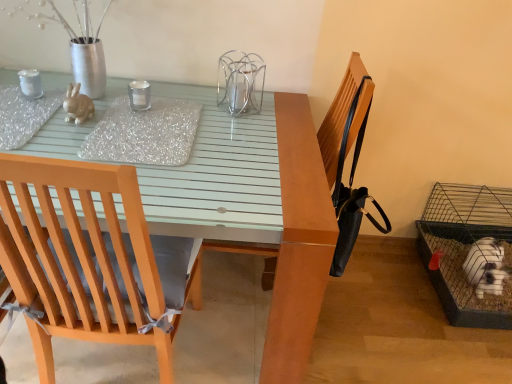
Question: Is matte ceramic rabbit at upper left facing towards black leather chair at upper right?

Choices:
 (A) no
 (B) yes

Answer: (A)

Question: Is matte ceramic rabbit at upper left further to camera compared to black leather chair at upper right?

Choices:
 (A) no
 (B) yes

Answer: (B)

Question: Does matte ceramic rabbit at upper left appear on the right side of black leather chair at upper right?

Choices:
 (A) no
 (B) yes

Answer: (A)

Question: From a real-world perspective, does matte ceramic rabbit at upper left stand above black leather chair at upper right?

Choices:
 (A) no
 (B) yes

Answer: (B)

Question: Can you confirm if matte ceramic rabbit at upper left is bigger than black leather chair at upper right?

Choices:
 (A) yes
 (B) no

Answer: (B)

Question: Considering the positions of wire mesh cage at lower right, the first bird cage from the right, and wooden chair at left in the image, is wire mesh cage at lower right, the first bird cage from the right, taller or shorter than wooden chair at left?

Choices:
 (A) tall
 (B) short

Answer: (B)

Question: Based on their sizes in the image, would you say wire mesh cage at lower right, marked as the 2th bird cage in a front-to-back arrangement, is bigger or smaller than wooden chair at left?

Choices:
 (A) big
 (B) small

Answer: (B)

Question: Considering the positions of wire mesh cage at lower right, which is the second bird cage in top-to-bottom order, and wooden chair at left in the image, is wire mesh cage at lower right, which is the second bird cage in top-to-bottom order, wider or thinner than wooden chair at left?

Choices:
 (A) wide
 (B) thin

Answer: (A)

Question: Considering their positions, is wire mesh cage at lower right, acting as the 2th bird cage starting from the left, located in front of or behind wooden chair at left?

Choices:
 (A) front
 (B) behind

Answer: (B)

Question: Considering their positions, is clear glass candle at center located in front of or behind wire mesh cage at lower right, acting as the 2th bird cage starting from the left?

Choices:
 (A) front
 (B) behind

Answer: (A)

Question: In the image, is clear glass candle at center on the left side or the right side of wire mesh cage at lower right, acting as the 2th bird cage starting from the left?

Choices:
 (A) left
 (B) right

Answer: (A)

Question: Is clear glass candle at center inside the boundaries of wire mesh cage at lower right, positioned as the 1th bird cage in bottom-to-top order, or outside?

Choices:
 (A) outside
 (B) inside

Answer: (A)

Question: Considering the positions of clear glass candle at center and wire mesh cage at lower right, acting as the 2th bird cage starting from the left, in the image, is clear glass candle at center wider or thinner than wire mesh cage at lower right, acting as the 2th bird cage starting from the left,?

Choices:
 (A) thin
 (B) wide

Answer: (A)

Question: Is clear glass candle at center taller or shorter than black leather chair at upper right?

Choices:
 (A) short
 (B) tall

Answer: (A)

Question: From a real-world perspective, is clear glass candle at center above or below black leather chair at upper right?

Choices:
 (A) below
 (B) above

Answer: (B)